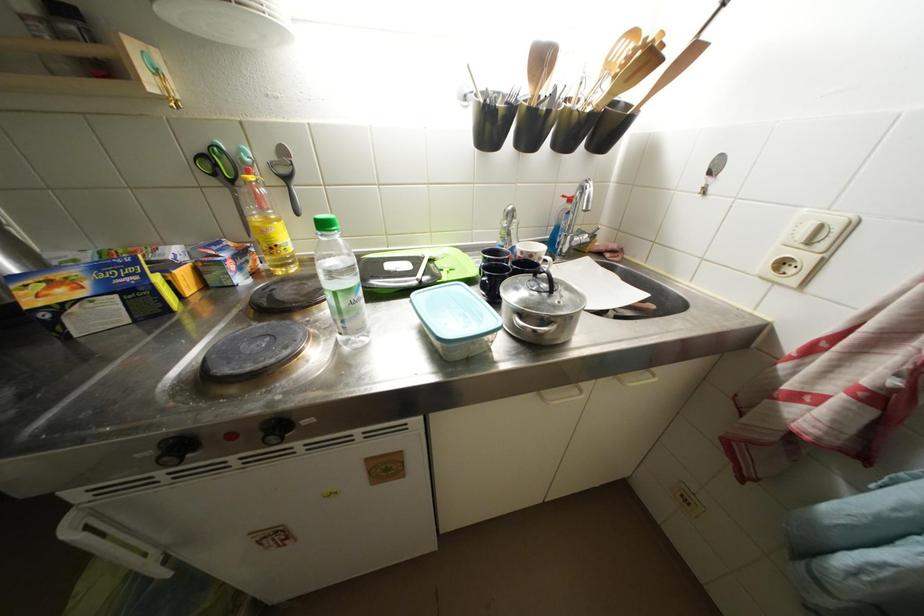
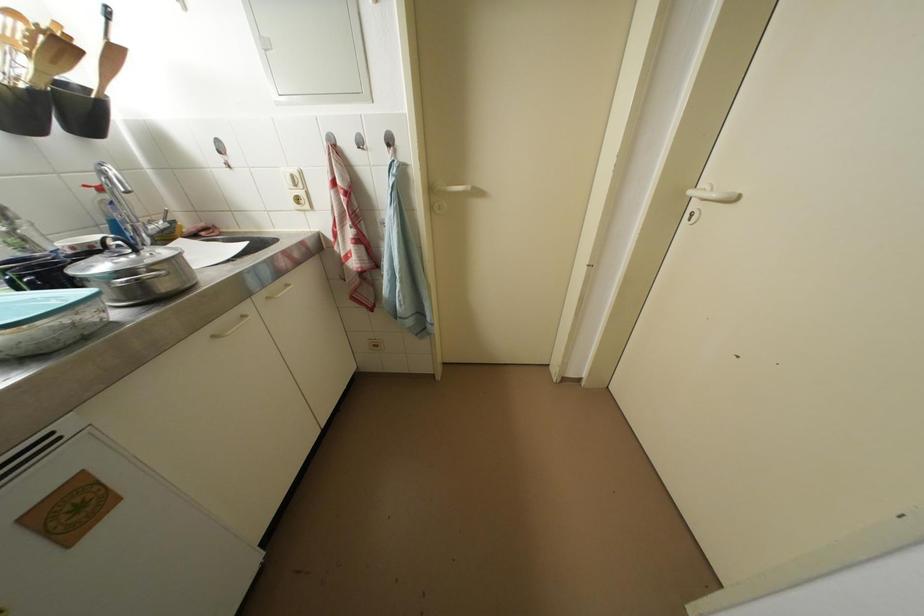
First-person continuous shooting, in which direction is the camera rotating?

The rotation direction of the camera is right-down.